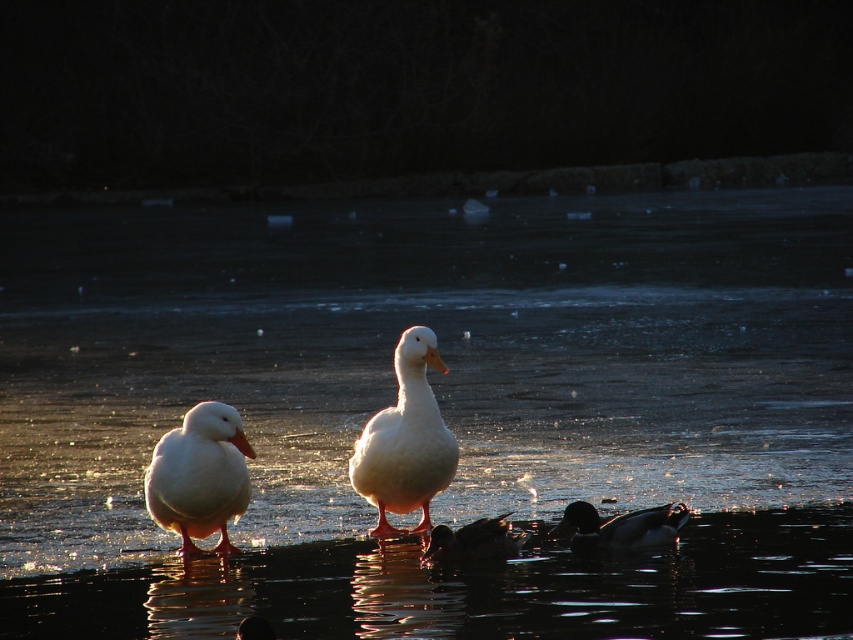
Based on the photo, can you confirm if white matte duck at center is shorter than shiny black duck at lower center?

In fact, white matte duck at center may be taller than shiny black duck at lower center.

Is point (387, 435) less distant than point (482, 550)?

Yes, it is.

The width and height of the screenshot is (853, 640). What are the coordinates of `white matte duck at center` in the screenshot? It's located at (405, 440).

Between point (189, 426) and point (467, 547), which one is positioned behind?

Point (467, 547)

Who is more forward, (175, 465) or (509, 556)?

Point (175, 465)

Locate an element on the screen. white matte duck at left is located at coordinates (199, 476).

Is dark brown glossy duck at lower center thinner than shiny black duck at lower center?

Incorrect, dark brown glossy duck at lower center's width is not less than shiny black duck at lower center's.

Who is lower down, dark brown glossy duck at lower center or shiny black duck at lower center?

Positioned lower is shiny black duck at lower center.

Does point (602, 540) lie behind point (496, 528)?

Yes, point (602, 540) is behind point (496, 528).

At what (x,y) coordinates should I click in order to perform the action: click on dark brown glossy duck at lower center. Please return your answer as a coordinate pair (x, y). The image size is (853, 640). Looking at the image, I should click on (621, 525).